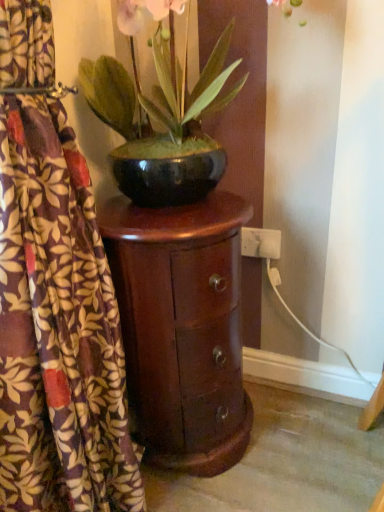
Question: From the image's perspective, is printed fabric curtain at left positioned above or below glossy wood nightstand at left?

Choices:
 (A) below
 (B) above

Answer: (B)

Question: Is printed fabric curtain at left spatially inside glossy wood nightstand at left, or outside of it?

Choices:
 (A) inside
 (B) outside

Answer: (B)

Question: Estimate the real-world distances between objects in this image. Which object is closer to the green glossy bowl at center?

Choices:
 (A) glossy wood nightstand at left
 (B) printed fabric curtain at left
 (C) white plastic electric outlet at lower right

Answer: (A)

Question: Which of these objects is positioned closest to the printed fabric curtain at left?

Choices:
 (A) glossy wood nightstand at left
 (B) green glossy bowl at center
 (C) white plastic electric outlet at lower right

Answer: (A)